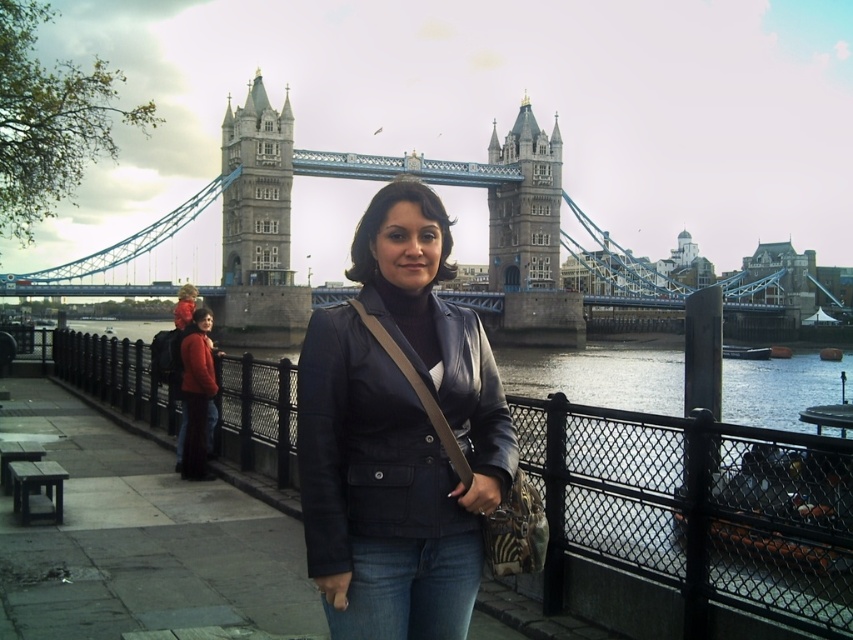
Can you confirm if stone tower at upper center is taller than stone tower at center?

Incorrect, stone tower at upper center's height is not larger of stone tower at center's.

Where is `stone tower at upper center`? stone tower at upper center is located at coordinates coord(256,189).

Can you confirm if matte black jacket at center is bigger than denim jeans at center?

Correct, matte black jacket at center is larger in size than denim jeans at center.

Which of these two, matte black jacket at center or denim jeans at center, stands shorter?

denim jeans at center is shorter.

Find the location of `matte black jacket at center`. matte black jacket at center is located at coordinates (398, 435).

Is stone gray suspension bridge at center to the right of denim jeans at center from the viewer's perspective?

Correct, you'll find stone gray suspension bridge at center to the right of denim jeans at center.

Which of these two, stone gray suspension bridge at center or denim jeans at center, stands shorter?

With less height is denim jeans at center.

Who is more distant from viewer, [524,163] or [387,614]?

The point [524,163] is more distant.

Identify the location of stone gray suspension bridge at center. (370, 179).